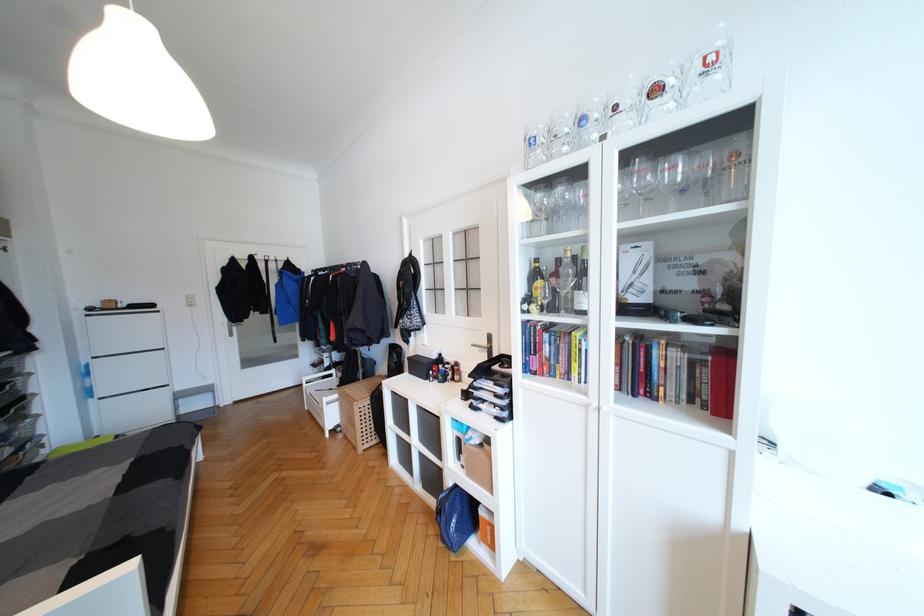
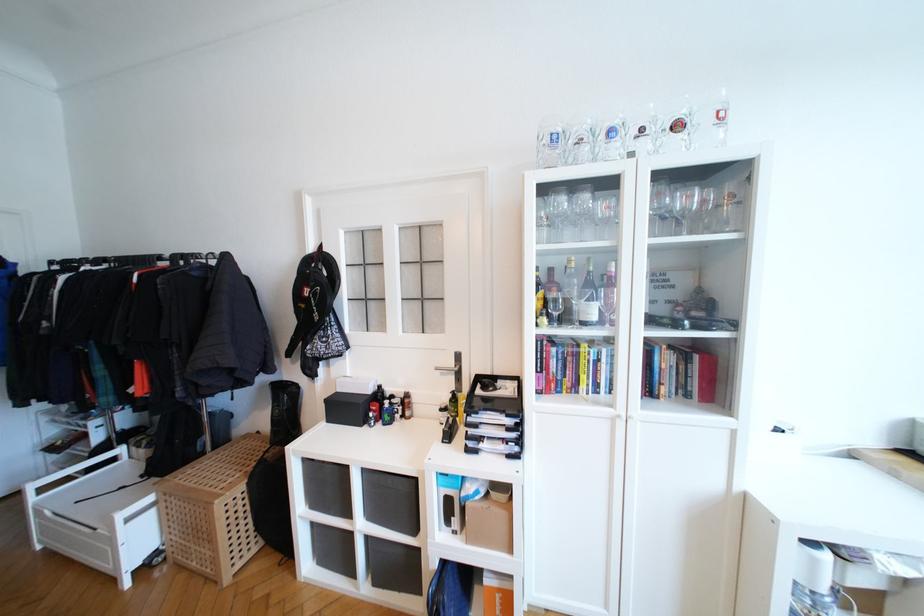
Where in the second image is the point corresponding to (x=334, y=377) from the first image?

(116, 461)